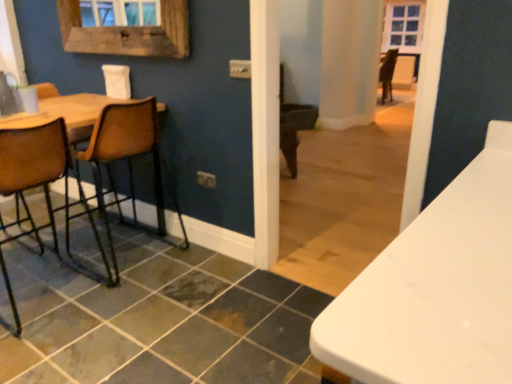
The height and width of the screenshot is (384, 512). In order to click on blank space situated above slate tile at lower left (from a real-world perspective) in this screenshot , I will do `click(123, 307)`.